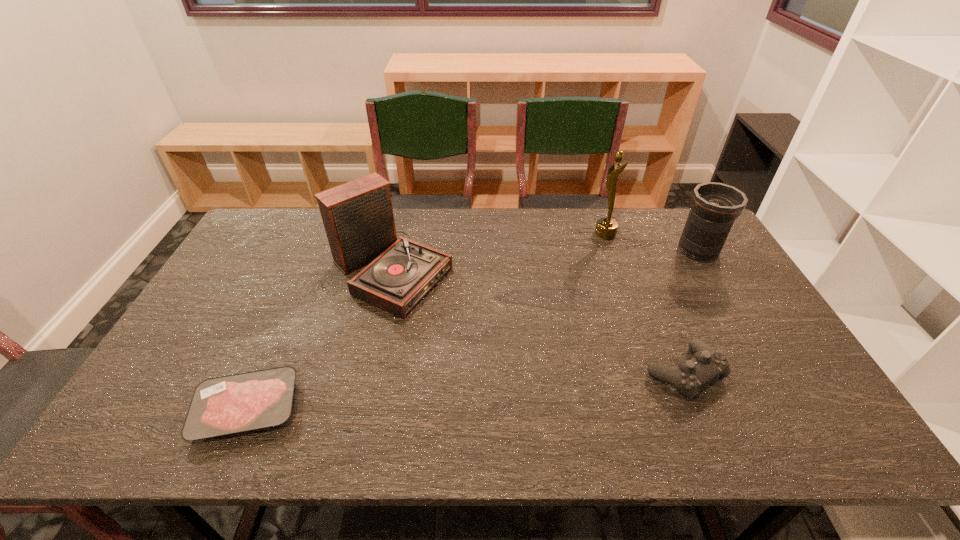
This screenshot has height=540, width=960. Identify the location of vacant space that satisfies the following two spatial constraints: 1. on the front-facing side of the tallest object; 2. on the front side of the phonograph record. (619, 271).